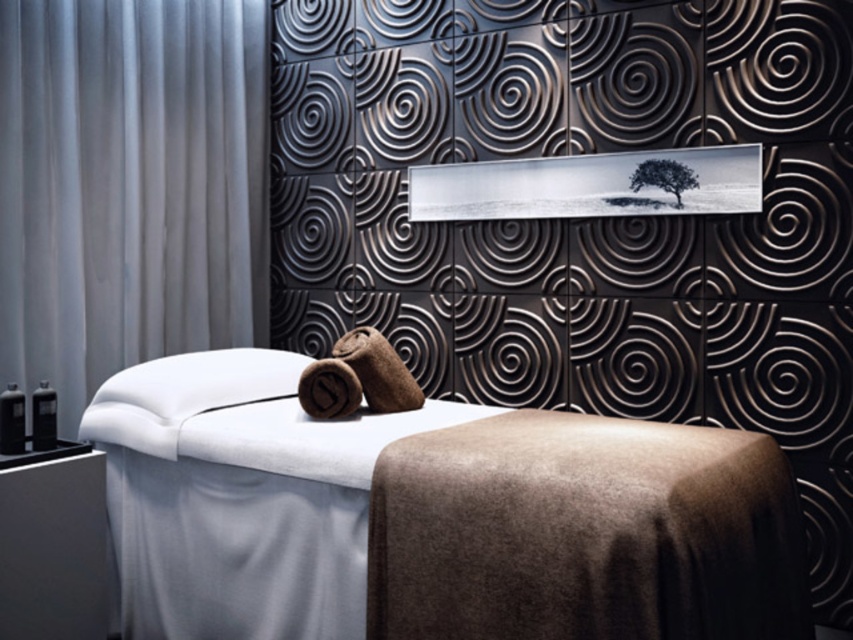
Question: Can you confirm if white fabric curtain at left is bigger than brown plush pillow at center?

Choices:
 (A) no
 (B) yes

Answer: (B)

Question: Is white fabric bed at center bigger than white fabric curtain at left?

Choices:
 (A) yes
 (B) no

Answer: (A)

Question: Which point appears closest to the camera in this image?

Choices:
 (A) (407, 371)
 (B) (659, 486)

Answer: (B)

Question: Which of these objects is positioned farthest from the brown plush pillow at center?

Choices:
 (A) white fabric curtain at left
 (B) white fabric bed at center

Answer: (A)

Question: Observing the image, what is the correct spatial positioning of white fabric curtain at left in reference to brown plush pillow at center?

Choices:
 (A) above
 (B) below

Answer: (A)

Question: Among these objects, which one is nearest to the camera?

Choices:
 (A) white fabric curtain at left
 (B) brown plush pillow at center

Answer: (B)